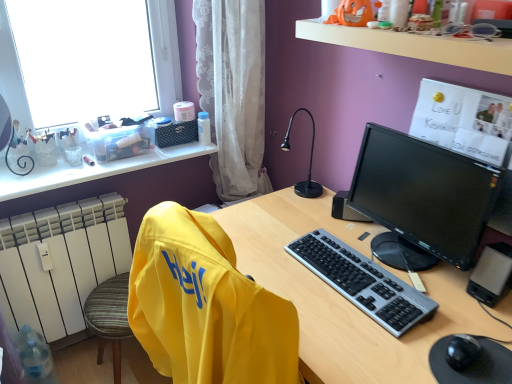
You are a GUI agent. You are given a task and a screenshot of the screen. Output one action in this format:
    pyautogui.click(x=<x>, y=<y>)
    Task: Click on the free space to the left of black glossy monitor at center right
    This screenshot has width=512, height=384.
    Given the screenshot: What is the action you would take?
    pyautogui.click(x=300, y=259)